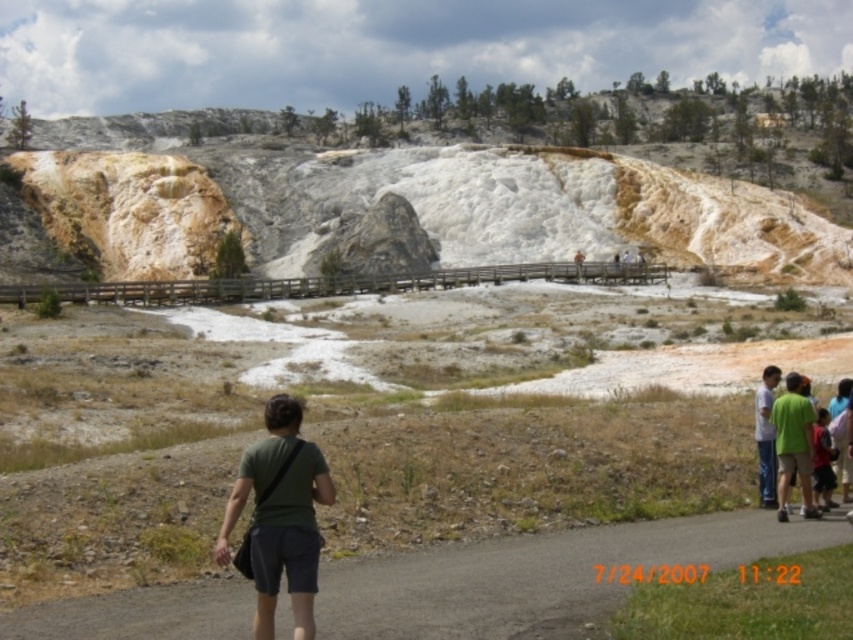
Is point (822, 428) positioned in front of point (579, 273)?

Yes, point (822, 428) is in front of point (579, 273).

Is dark green shirt at lower right to the left of green fabric shirt at center from the viewer's perspective?

Indeed, dark green shirt at lower right is positioned on the left side of green fabric shirt at center.

At what (x,y) coordinates should I click in order to perform the action: click on dark green shirt at lower right. Please return your answer as a coordinate pair (x, y). Looking at the image, I should click on (822, 461).

This screenshot has width=853, height=640. I want to click on dark green shirt at lower right, so click(x=822, y=461).

Looking at this image, can you confirm if green fabric shirt at lower center is shorter than green fabric shirt at lower right?

No.

In the scene shown: Who is more distant from viewer, (x=263, y=468) or (x=805, y=444)?

Positioned behind is point (x=805, y=444).

At what (x,y) coordinates should I click in order to perform the action: click on green fabric shirt at lower center. Please return your answer as a coordinate pair (x, y). Looking at the image, I should click on (289, 541).

This screenshot has width=853, height=640. Find the location of `green fabric shirt at lower center`. green fabric shirt at lower center is located at coordinates (289, 541).

Does gray asphalt path at lower center have a lesser width compared to dark green shirt at lower right?

No, gray asphalt path at lower center is not thinner than dark green shirt at lower right.

Describe the element at coordinates (538, 577) in the screenshot. I see `gray asphalt path at lower center` at that location.

Find the location of a particular element. gray asphalt path at lower center is located at coordinates (538, 577).